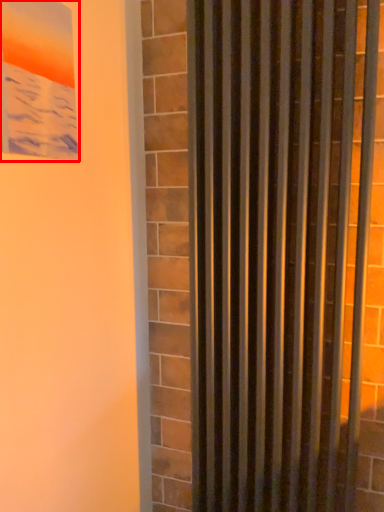
Question: Observing the image, what is the correct spatial positioning of picture frame (annotated by the red box) in reference to curtain?

Choices:
 (A) right
 (B) left

Answer: (B)